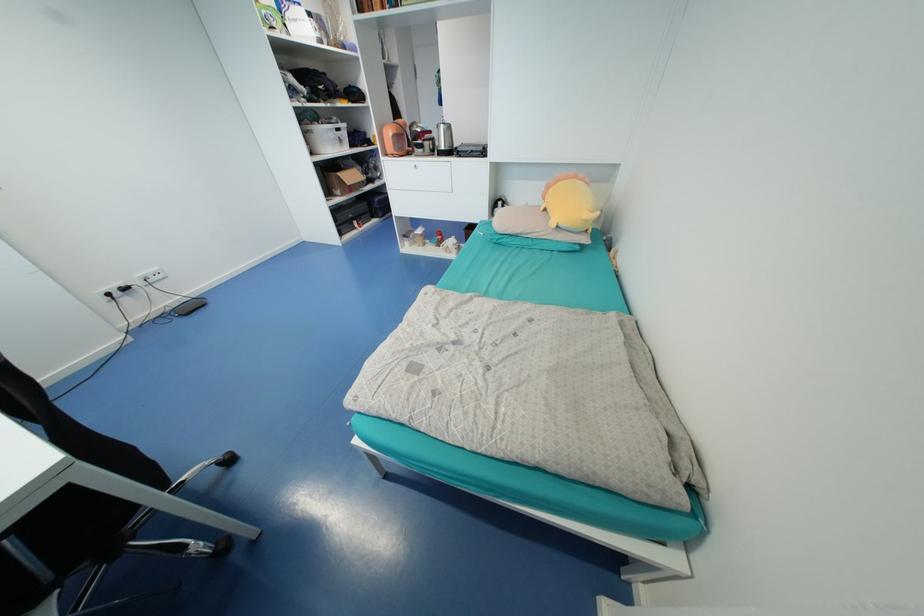
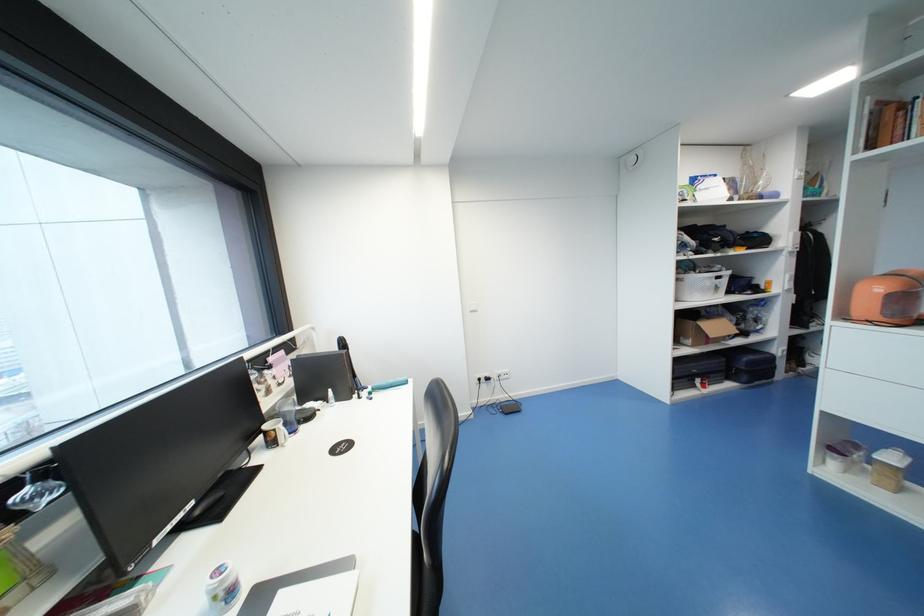
In the second image, find the point that corresponds to point 378,217 in the first image.

(733, 379)